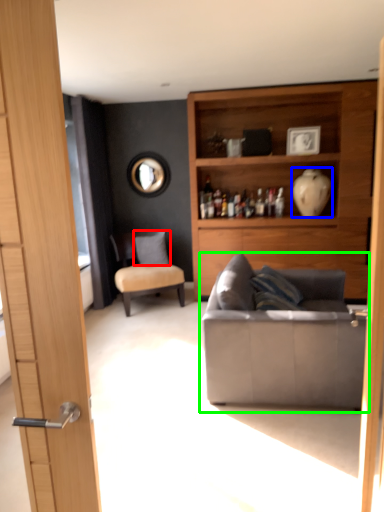
Question: Which object is positioned closest to pillow (highlighted by a red box)? Select from vase (highlighted by a blue box) and studio couch (highlighted by a green box).

Choices:
 (A) vase
 (B) studio couch

Answer: (A)